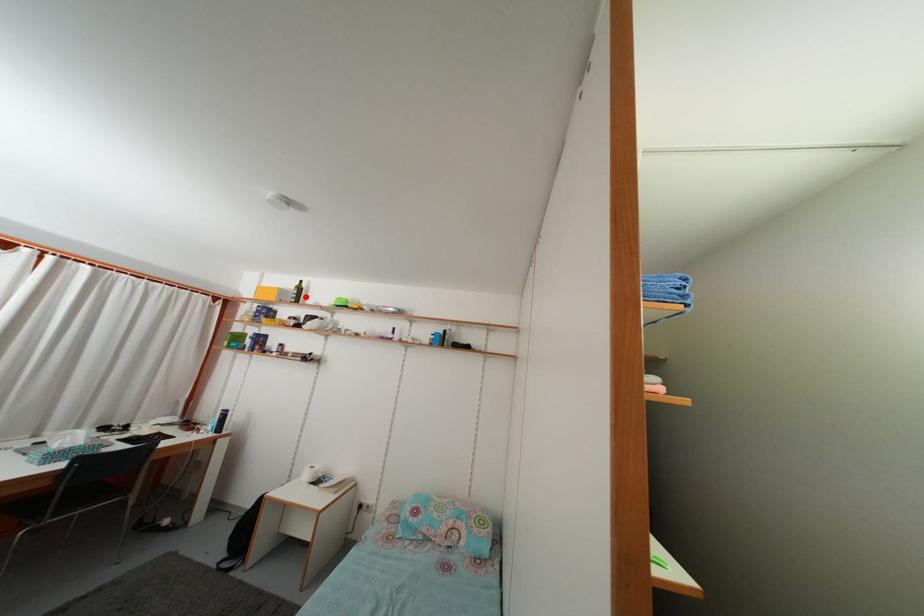
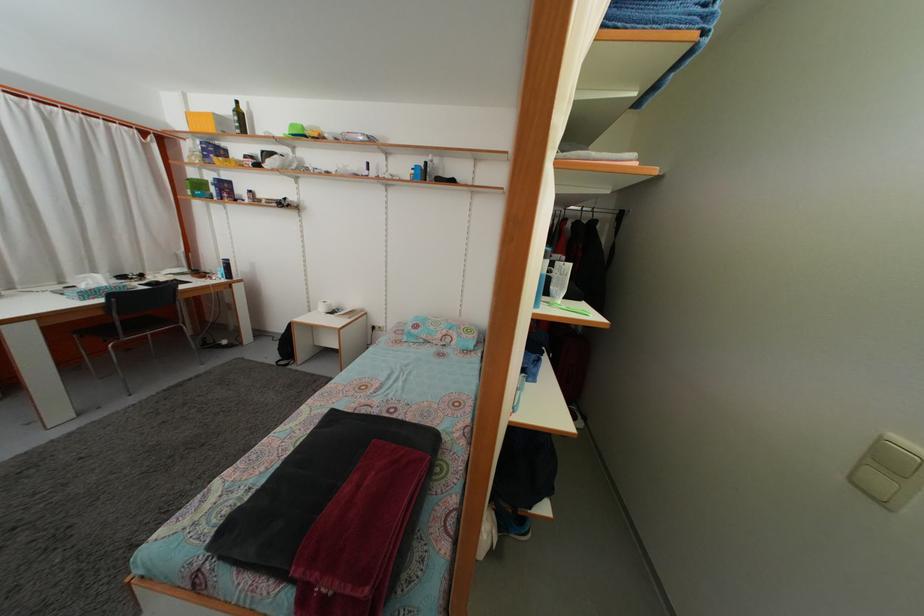
The point at the highlighted location is marked in the first image. Where is the corresponding point in the second image?

(246, 122)